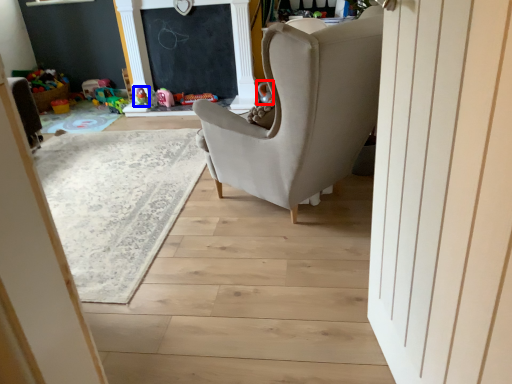
Question: Which object is closer to the camera taking this photo, toy (highlighted by a red box) or toy (highlighted by a blue box)?

Choices:
 (A) toy
 (B) toy

Answer: (A)